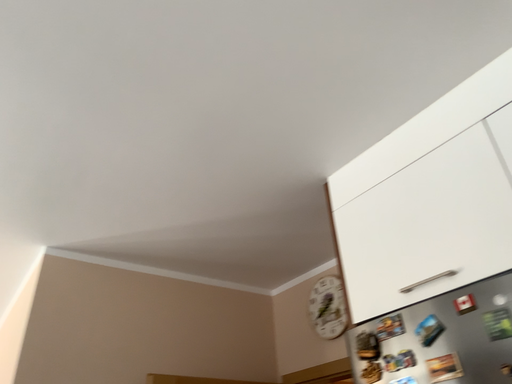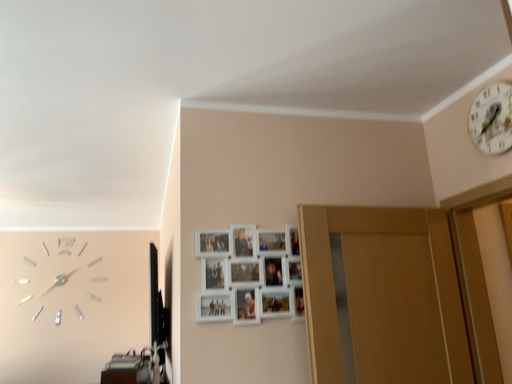
Question: How did the camera likely rotate when shooting the video?

Choices:
 (A) rotated downward
 (B) rotated upward

Answer: (A)